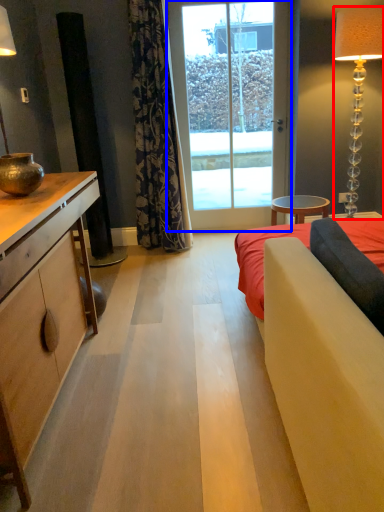
Question: Which of the following is the farthest to the observer, lamp (highlighted by a red box) or glass door (highlighted by a blue box)?

Choices:
 (A) lamp
 (B) glass door

Answer: (B)